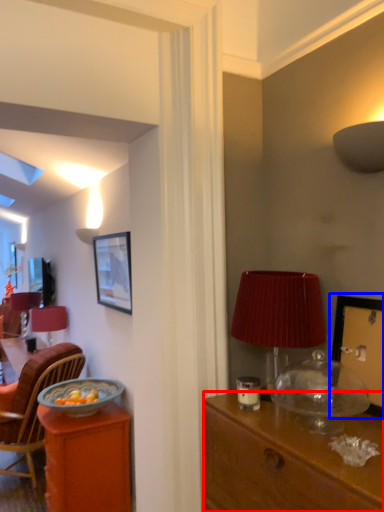
Question: Which object is closer to the camera taking this photo, desk (highlighted by a red box) or picture frame (highlighted by a blue box)?

Choices:
 (A) desk
 (B) picture frame

Answer: (A)